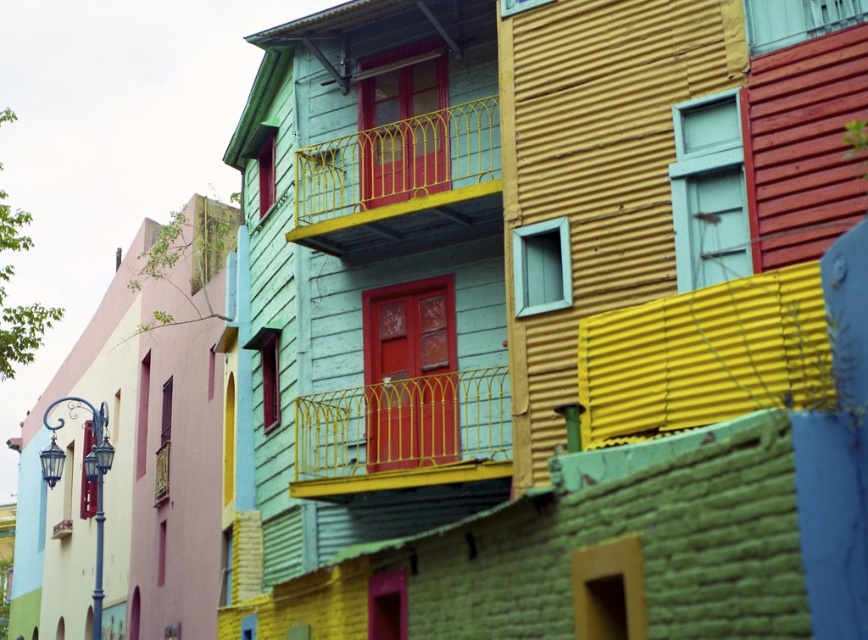
Question: Which point is closer to the camera?

Choices:
 (A) (592, 326)
 (B) (314, 195)
 (C) (379, 458)

Answer: (A)

Question: Does yellow corrugated metal at center come behind yellow metal/railings at center?

Choices:
 (A) no
 (B) yes

Answer: (A)

Question: Estimate the real-world distances between objects in this image. Which object is farther from the yellow metal railing at center?

Choices:
 (A) yellow corrugated metal at center
 (B) yellow metal/railings at center

Answer: (A)

Question: Does yellow corrugated metal at center appear on the right side of yellow metal/railings at center?

Choices:
 (A) no
 (B) yes

Answer: (B)

Question: Is yellow corrugated metal at center to the left of yellow metal railing at center from the viewer's perspective?

Choices:
 (A) no
 (B) yes

Answer: (A)

Question: Which of these objects is positioned closest to the yellow corrugated metal at center?

Choices:
 (A) yellow metal/railings at center
 (B) yellow metal railing at center

Answer: (B)